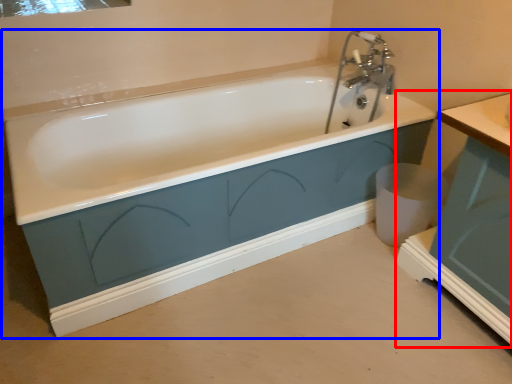
Question: Which object appears farthest to the camera in this image, vanity (highlighted by a red box) or bathtub (highlighted by a blue box)?

Choices:
 (A) vanity
 (B) bathtub

Answer: (B)